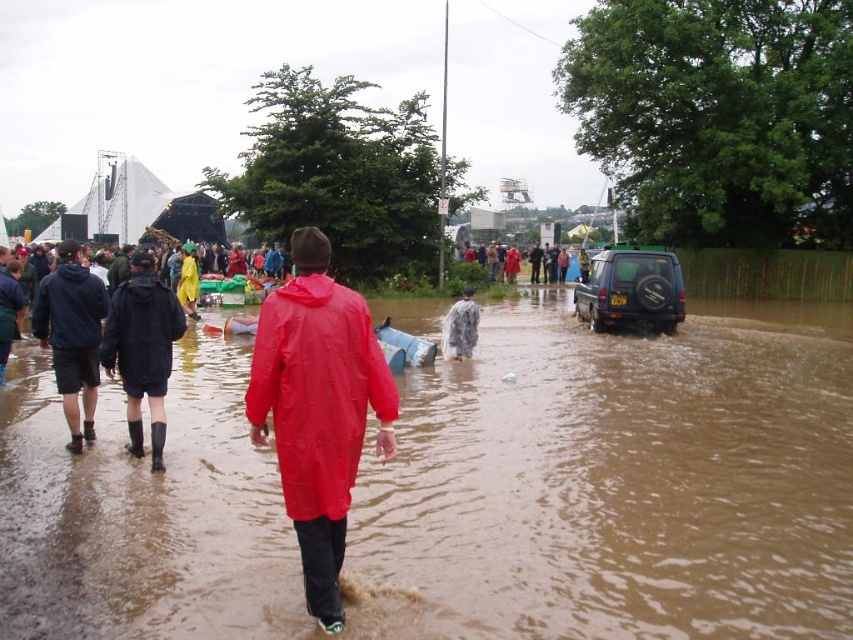
You are standing at the point with coordinates point (142, 349). What object is located at that point?

The point (142, 349) is on black rubber boots at left.

You are standing on the edge of the flooded area and see the brown matte flood at center and the yellow matte raincoat at center. Which object is located to the right of the other?

The brown matte flood at center is to the right of the yellow matte raincoat at center.